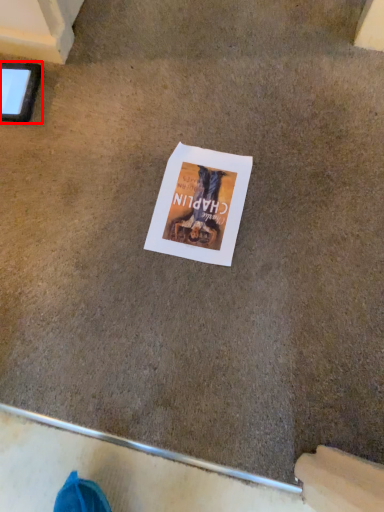
Question: From the image's perspective, where is tablet computer (annotated by the red box) located in relation to flyer in the image?

Choices:
 (A) below
 (B) above

Answer: (B)